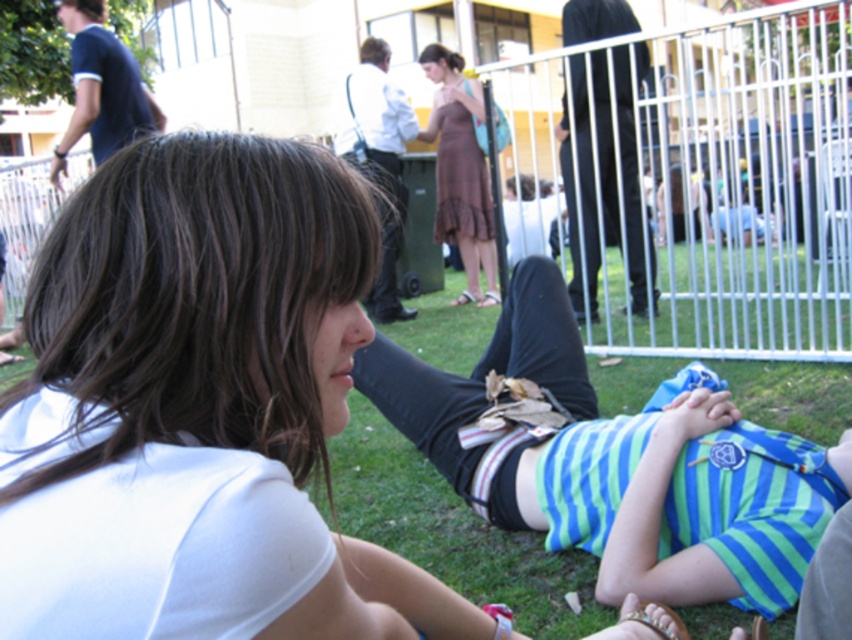
Question: Is white matte shirt at center smaller than brown dress at center?

Choices:
 (A) no
 (B) yes

Answer: (B)

Question: Which point is farther to the camera?

Choices:
 (A) brown dress at center
 (B) white matte shirt at center

Answer: (A)

Question: Can you confirm if white matte shirt at center is positioned below brown dress at center?

Choices:
 (A) yes
 (B) no

Answer: (A)

Question: From the image, what is the correct spatial relationship of white matte shirt at center in relation to brown dress at center?

Choices:
 (A) above
 (B) below

Answer: (B)